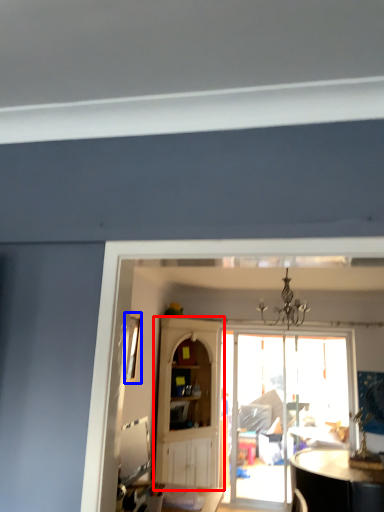
Question: Which object is further to the camera taking this photo, cabinetry (highlighted by a red box) or window (highlighted by a blue box)?

Choices:
 (A) cabinetry
 (B) window

Answer: (A)